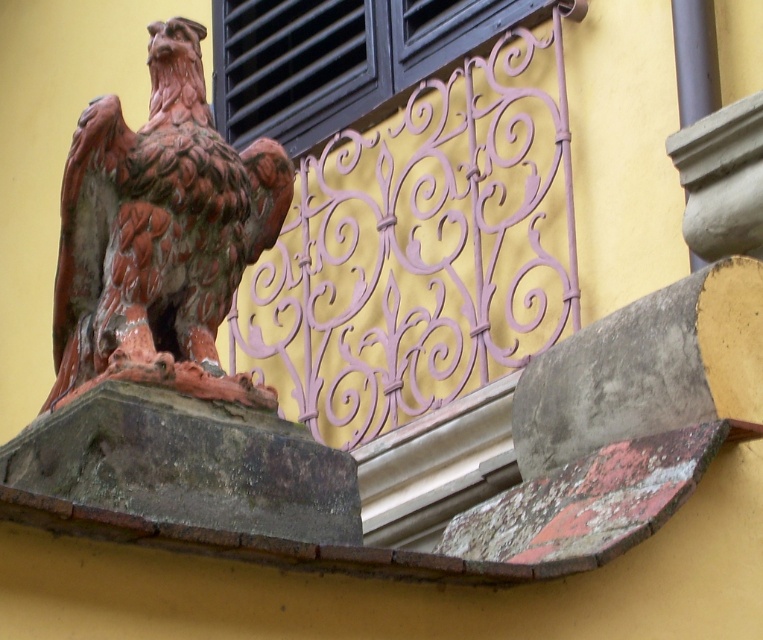
Can you confirm if rusty metal eagle at left is positioned to the left of black matte window at upper center?

Indeed, rusty metal eagle at left is positioned on the left side of black matte window at upper center.

Does rusty metal eagle at left have a larger size compared to black matte window at upper center?

Indeed, rusty metal eagle at left has a larger size compared to black matte window at upper center.

Between point (102, 186) and point (301, 152), which one is positioned in front?

Point (102, 186) is in front.

The width and height of the screenshot is (763, 640). Identify the location of rusty metal eagle at left. (159, 236).